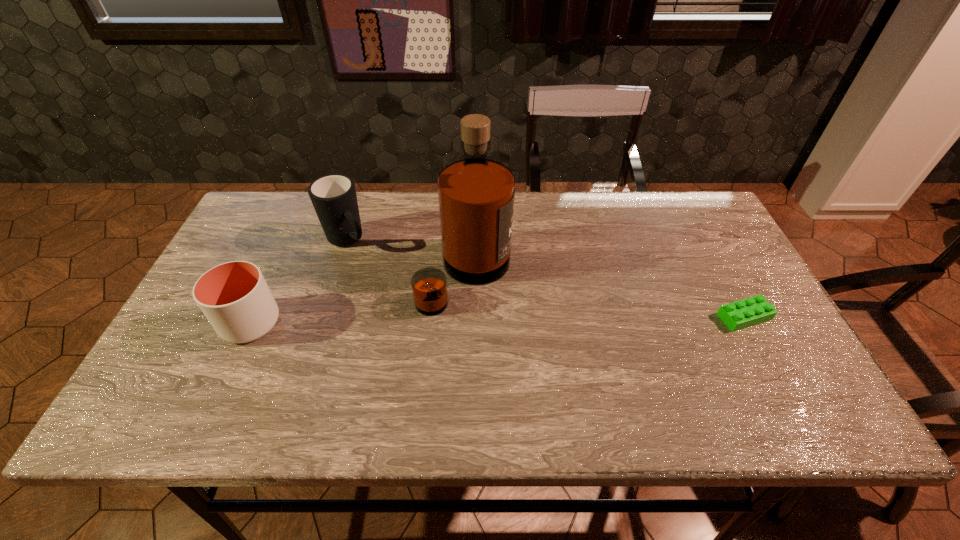
Locate an element on the screen. This screenshot has width=960, height=540. vacant space on the desktop that is between the cup and the Lego and is positioned on the side of the mug with the handle is located at coordinates (428, 321).

Where is `vacant space on the desktop that is between the leftmost object and the Lego and is positioned on the front label of the third object from left to right`? Image resolution: width=960 pixels, height=540 pixels. vacant space on the desktop that is between the leftmost object and the Lego and is positioned on the front label of the third object from left to right is located at coordinates (568, 319).